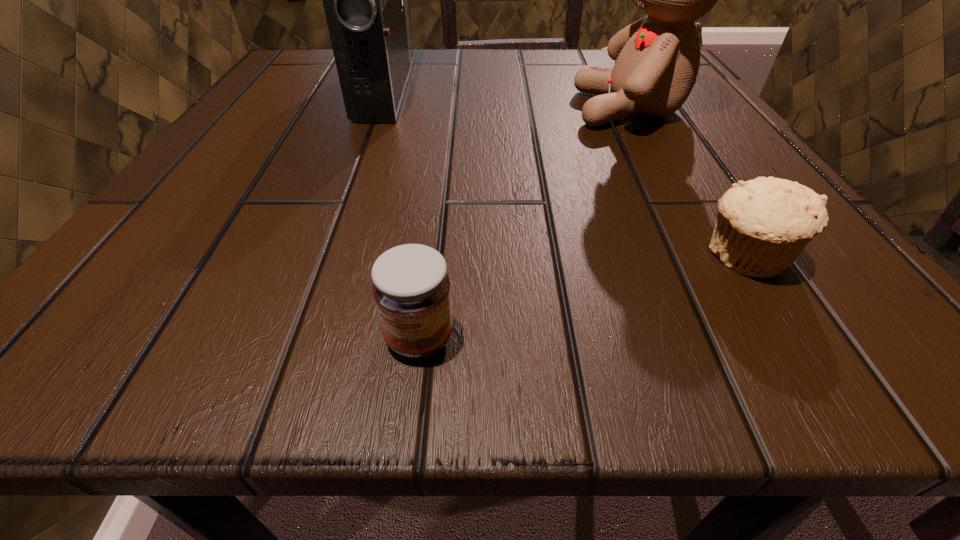
Where is `vacant space that satisfies the following two spatial constraints: 1. on the front-facing side of the radio receiver; 2. on the back side of the nearest object`? The height and width of the screenshot is (540, 960). vacant space that satisfies the following two spatial constraints: 1. on the front-facing side of the radio receiver; 2. on the back side of the nearest object is located at coordinates (294, 338).

I want to click on free space that satisfies the following two spatial constraints: 1. on the front-facing side of the leftmost object; 2. on the back side of the jam, so click(x=294, y=338).